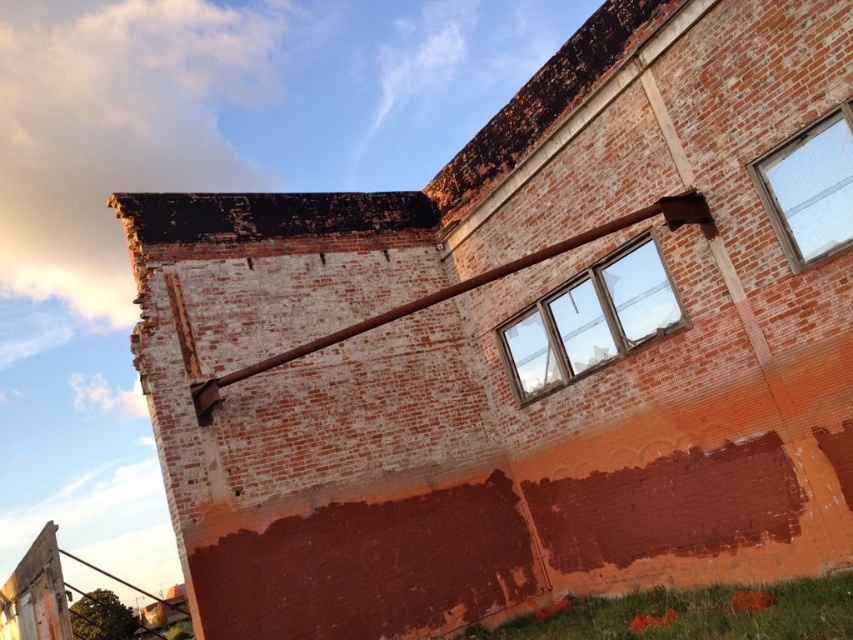
Question: Which object is closer to the camera taking this photo?

Choices:
 (A) clear glass window at upper right
 (B) clear glass window at center

Answer: (A)

Question: Does clear glass window at center have a lesser width compared to clear glass window at upper right?

Choices:
 (A) no
 (B) yes

Answer: (A)

Question: In this image, where is clear glass window at center located relative to clear glass window at upper right?

Choices:
 (A) below
 (B) above

Answer: (A)

Question: Which of the following is the closest to the observer?

Choices:
 (A) (793, 259)
 (B) (666, 314)

Answer: (A)

Question: Is clear glass window at center to the right of clear glass window at upper right from the viewer's perspective?

Choices:
 (A) yes
 (B) no

Answer: (B)